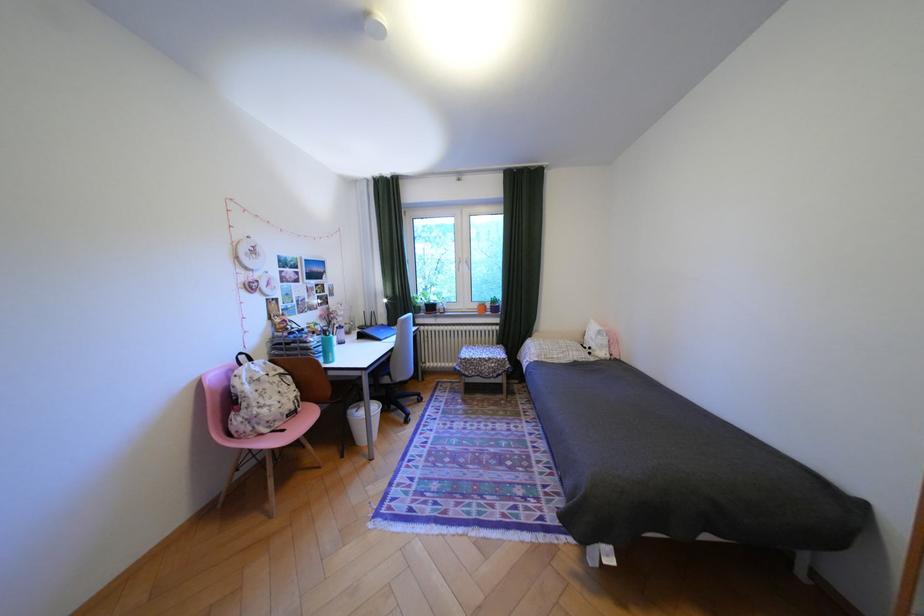
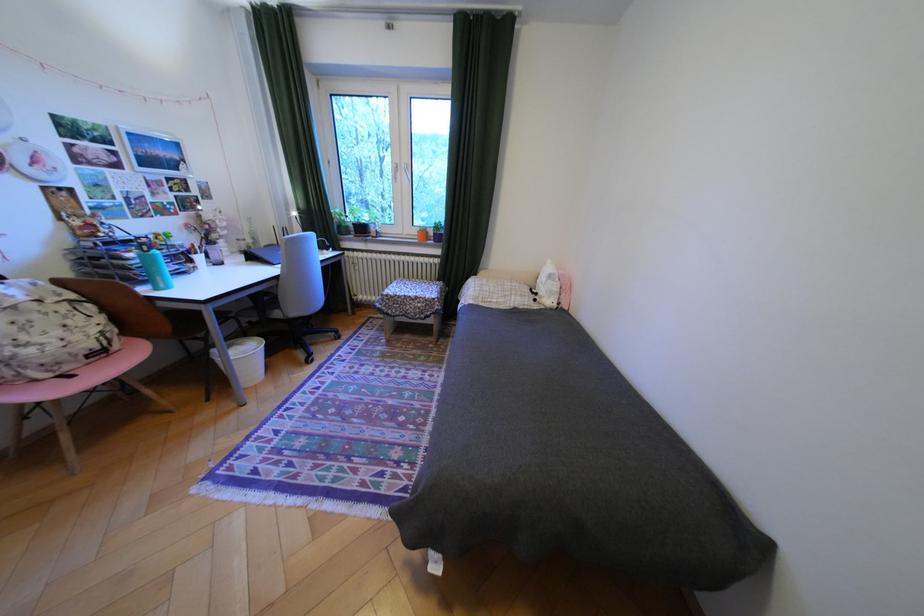
In the second image, find the point that corresponds to (322,339) in the first image.

(140, 254)